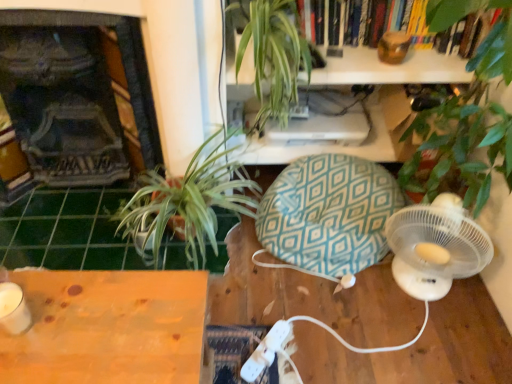
Locate an element on the screen. This screenshot has height=384, width=512. vacant point above wooden table at lower left (from a real-world perspective) is located at coordinates (83, 312).